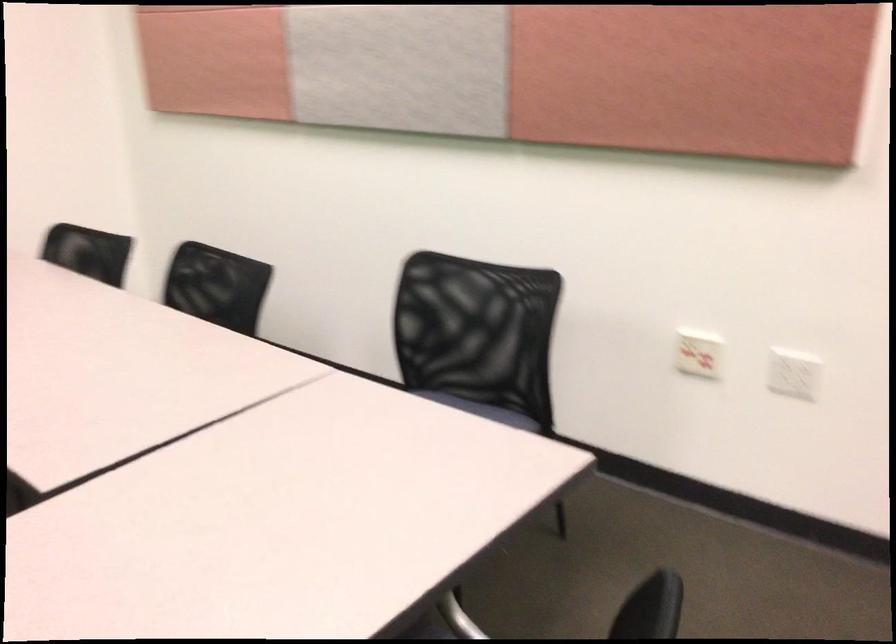
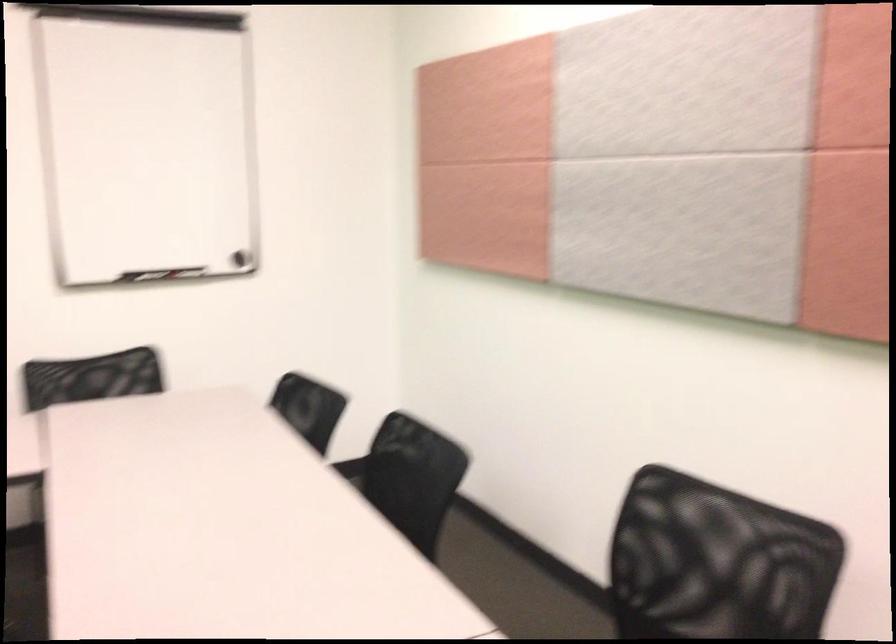
The point at (202,303) is marked in the first image. Where is the corresponding point in the second image?

(412, 478)